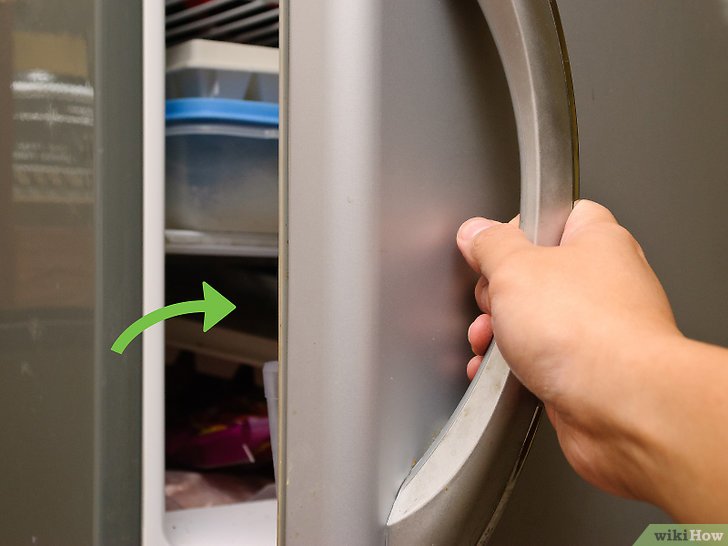
The image size is (728, 546). In order to click on handle of fridge in this screenshot , I will do `click(533, 72)`.